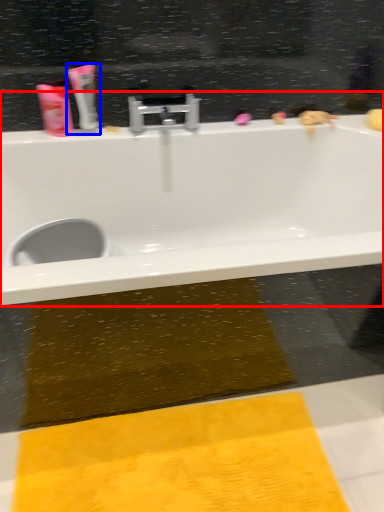
Question: Which object appears farthest to the camera in this image, bathtub (highlighted by a red box) or toothpaste (highlighted by a blue box)?

Choices:
 (A) bathtub
 (B) toothpaste

Answer: (B)